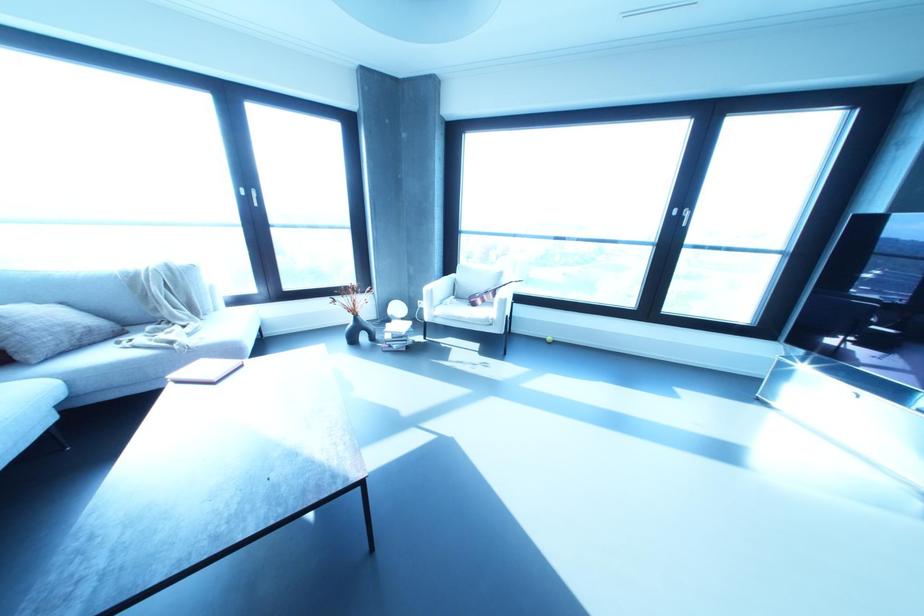
What do you see at coordinates (359, 331) in the screenshot? The height and width of the screenshot is (616, 924). I see `the black decorative vase` at bounding box center [359, 331].